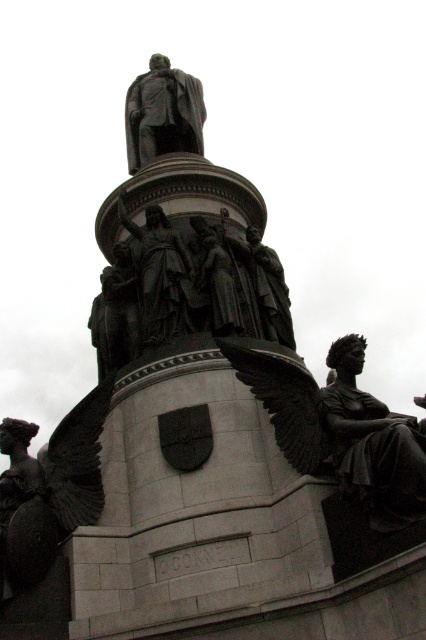
Question: Which point is closer to the camera?

Choices:
 (A) bronze statue at center
 (B) polished bronze statue at right

Answer: (B)

Question: Is polished bronze statue at right bigger than bronze statue at center?

Choices:
 (A) no
 (B) yes

Answer: (A)

Question: Is polished bronze statue at right to the left of bronze statue at center from the viewer's perspective?

Choices:
 (A) no
 (B) yes

Answer: (A)

Question: Which point is farther to the camera?

Choices:
 (A) [345, 436]
 (B) [141, 134]

Answer: (B)

Question: Does polished bronze statue at right appear on the left side of bronze statue at center?

Choices:
 (A) no
 (B) yes

Answer: (A)